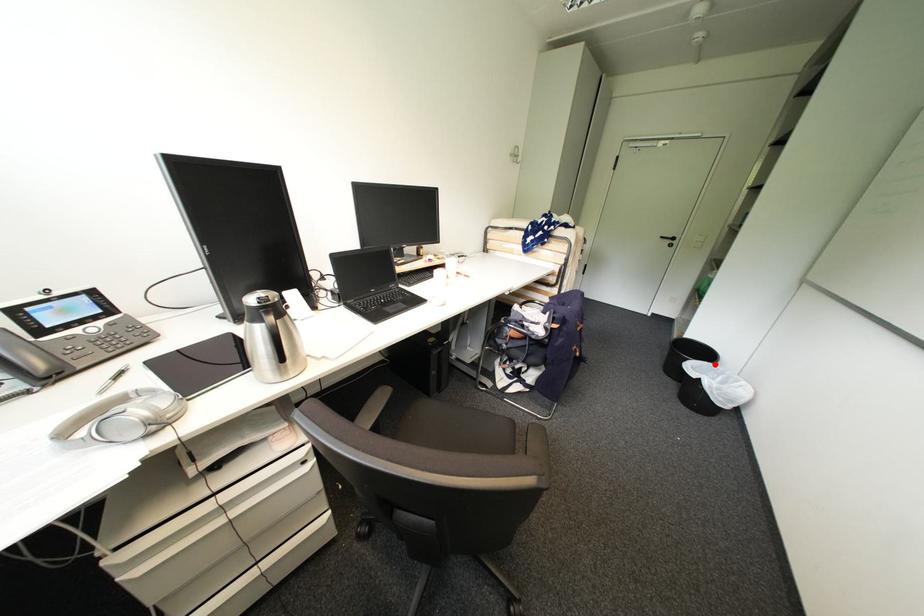
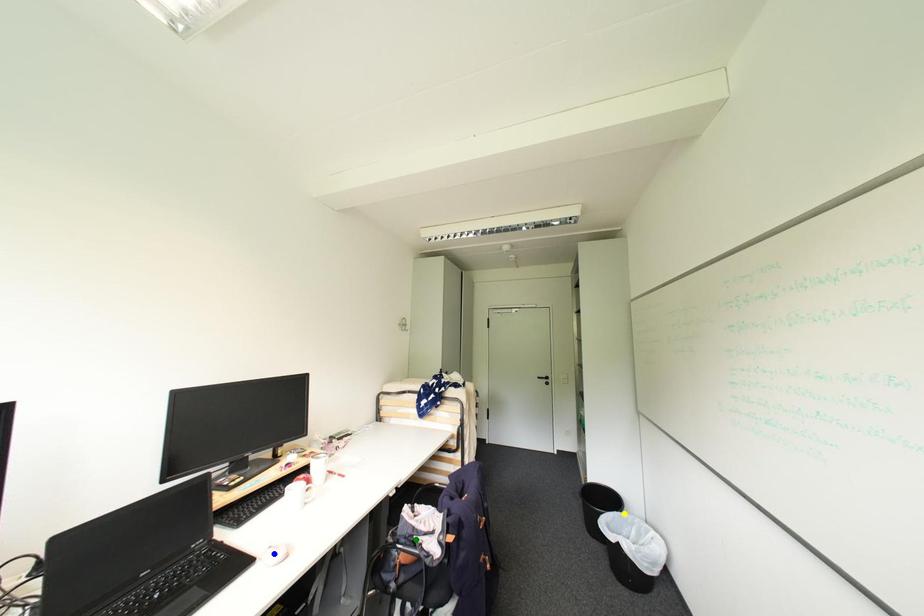
Question: I am providing you with two images of the same scene from different viewpoints. A red point is marked on the first image. You are given multiple points on the second image. Which spot in image 2 lines up with the point in image 1?

Choices:
 (A) green point
 (B) blue point
 (C) yellow point

Answer: (C)